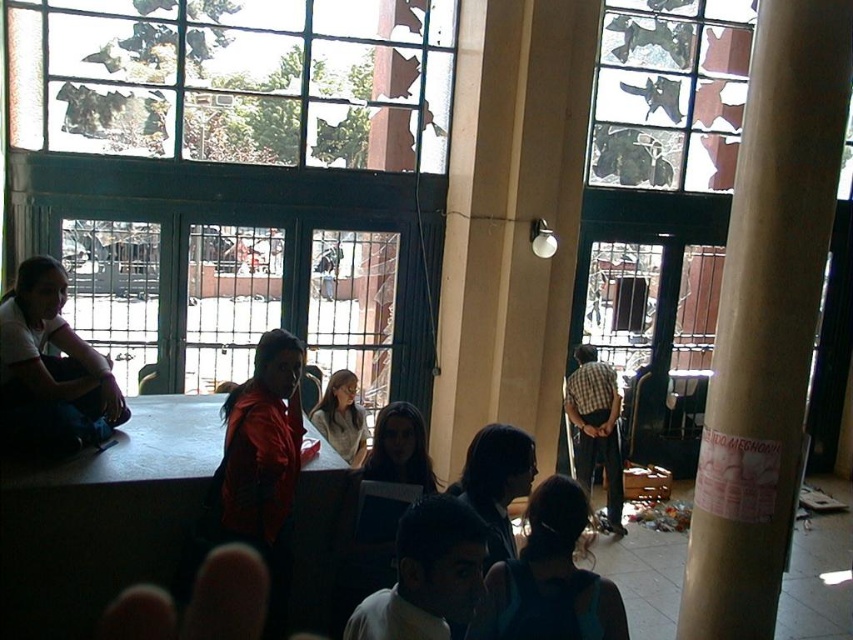
You are standing at the entrance of the building and want to move towards the point labeled as point (366, 602). However, there is an obstacle at point (509, 480). Can you walk directly to your destination without going around the obstacle?

Since point (366, 602) is in front of point (509, 480), you can walk directly to your destination without needing to go around the obstacle at point (509, 480).

You are standing inside the building and want to find the matte white shirt at left. According to the coordinates provided, where should you look relative to your position?

The matte white shirt at left is located at point 0.578 on the x axis and 0.060 on the y axis relative to your position.

Consider the image. You are a photographer trying to capture a clear image of the matte white shirt at left and the light gray sweater at center. Since the lighting inside is dim, which object might be harder to photograph clearly due to its position relative to the light coming through the broken windows?

The matte white shirt at left is in front of the light gray sweater at center, so it is closer to the photographer. However, since the light is coming from the broken windows, the light gray sweater at center might be harder to photograph clearly because it is further away from the light source and in a darker area of the room.